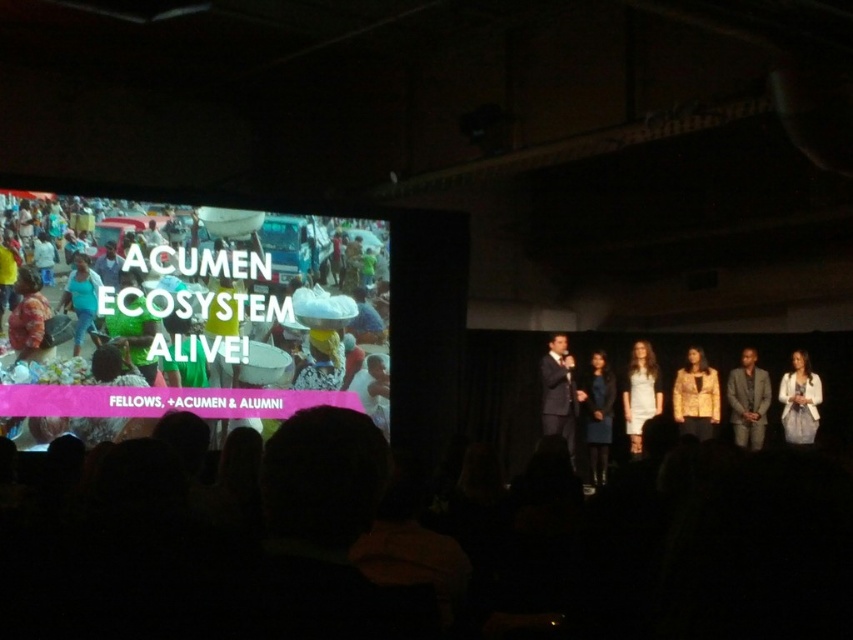
You are an event organizer and need to decide which of the two speakers wearing the gold textured blazer at center and the gray textured suit at center can fit through a narrow doorway. Based on their attire, which speaker might have a better chance of fitting through without adjusting their posture?

The gray textured suit at center might fit through the narrow doorway more easily since the gold textured blazer at center is wider than the gray textured suit at center, making it harder to pass through tight spaces without adjusting posture.

You are sitting in the audience facing the stage and notice two points marked on the large screen. The first point is at coordinates point (703, 364) and the second is at point (77, 276). Which point appears closer to you?

Point (703, 364) is further to the viewer than point (77, 276), so the second point is closer to you.

You are an event planner standing at the back of the hall. You need to ensure that both the gold textured blazer at center and the matte blue shirt at center are visible on the large screen on the left. Given that the screen is 10 meters wide, can both items be seen on the screen simultaneously?

The gold textured blazer at center and the matte blue shirt at center are 28.03 meters apart from each other. Since the screen is only 10 meters wide, they cannot both be seen on the screen simultaneously because the distance between them exceeds the screen width.